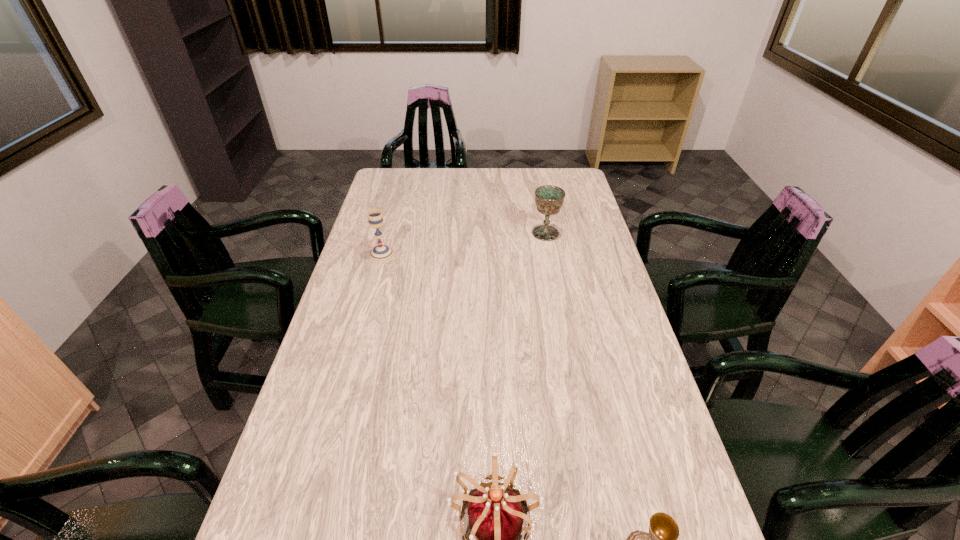
This screenshot has height=540, width=960. In order to click on the farthest chalice in this screenshot , I will do [549, 199].

Find the location of `the leftmost chalice`. the leftmost chalice is located at coordinates (380, 253).

Where is `the second farthest chalice`? the second farthest chalice is located at coordinates (380, 253).

Identify the location of vacant position located on the left of the farthest chalice. (478, 233).

This screenshot has height=540, width=960. I want to click on vacant point located 0.190m on the right of the second farthest chalice, so click(x=447, y=254).

You are a GUI agent. You are given a task and a screenshot of the screen. Output one action in this format:
    pyautogui.click(x=<x>, y=<y>)
    Task: Click on the object that is at the left edge
    This screenshot has height=540, width=960.
    Given the screenshot: What is the action you would take?
    pyautogui.click(x=380, y=253)

Identify the location of object that is at the right edge. This screenshot has width=960, height=540. (549, 199).

In the image, there is a desktop. Where is `vacant space at the far edge`? vacant space at the far edge is located at coordinates (444, 179).

Find the location of `free space at the left edge of the desktop`. free space at the left edge of the desktop is located at coordinates (382, 234).

In the image, there is a desktop. Identify the location of vacant space at the right edge. This screenshot has height=540, width=960. tap(600, 251).